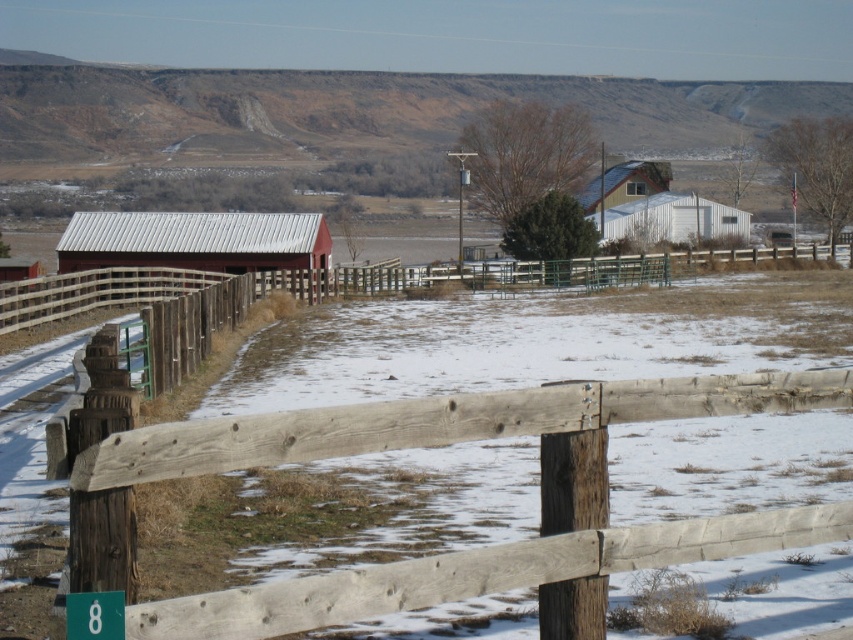
You are standing in the rural landscape and want to take a photo of the weathered wood fence at center and the metallic red barn at center. Which object should you focus on first if you want to capture both in the same frame without moving the camera?

The weathered wood fence at center is positioned under the metallic red barn at center, so focusing on the fence first will allow both to be in the frame since the barn is above it.

You are a farmer who wants to install a new fence post between the weathered wood fence at center and the white corrugated metal barn at center. Based on their sizes, which structure will require more space for the post to be placed between them?

The white corrugated metal barn at center requires more space because it is larger than the weathered wood fence at center, so the post should be placed closer to the smaller fence to maintain balance.